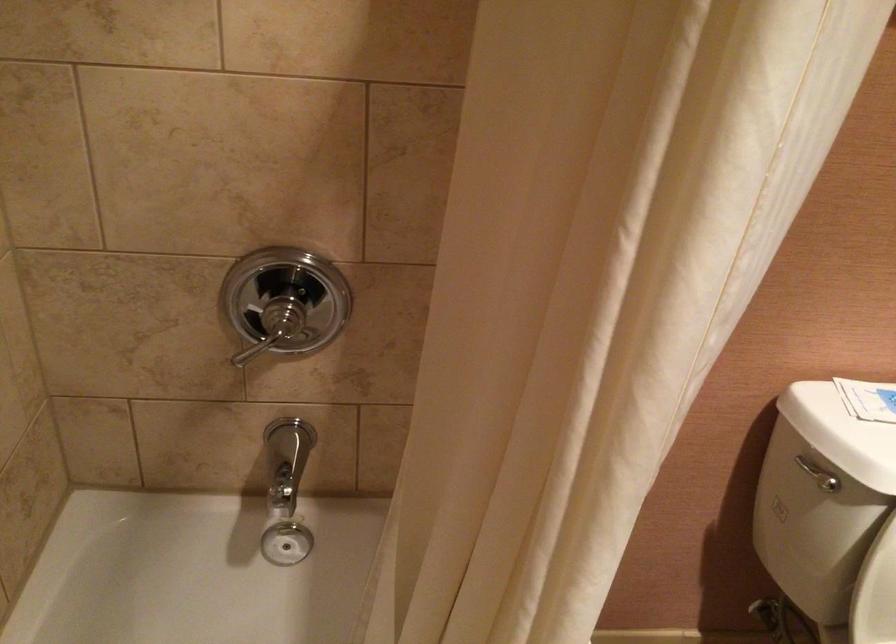
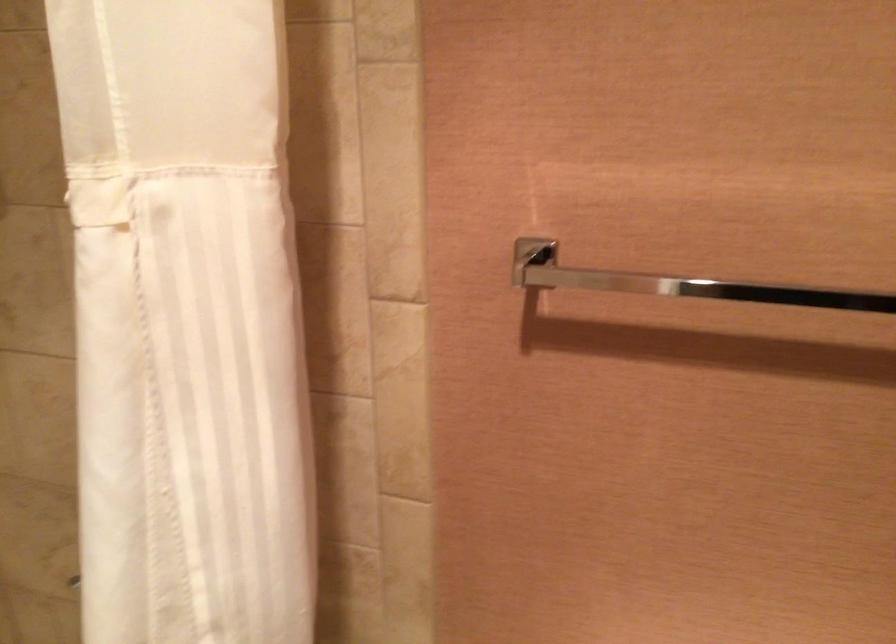
Question: The camera is either moving clockwise (left) or counter-clockwise (right) around the object. The first image is from the beginning of the video and the second image is from the end. Is the camera moving left or right when shooting the video?

Choices:
 (A) Left
 (B) Right

Answer: (B)